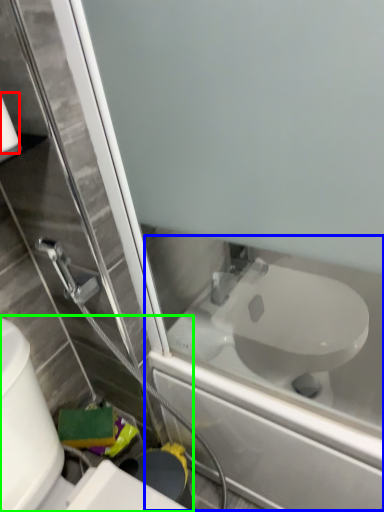
Question: Which object is the farthest from toilet paper (highlighted by a red box)? Choose among these: bath (highlighted by a blue box) or toilet (highlighted by a green box).

Choices:
 (A) bath
 (B) toilet

Answer: (A)